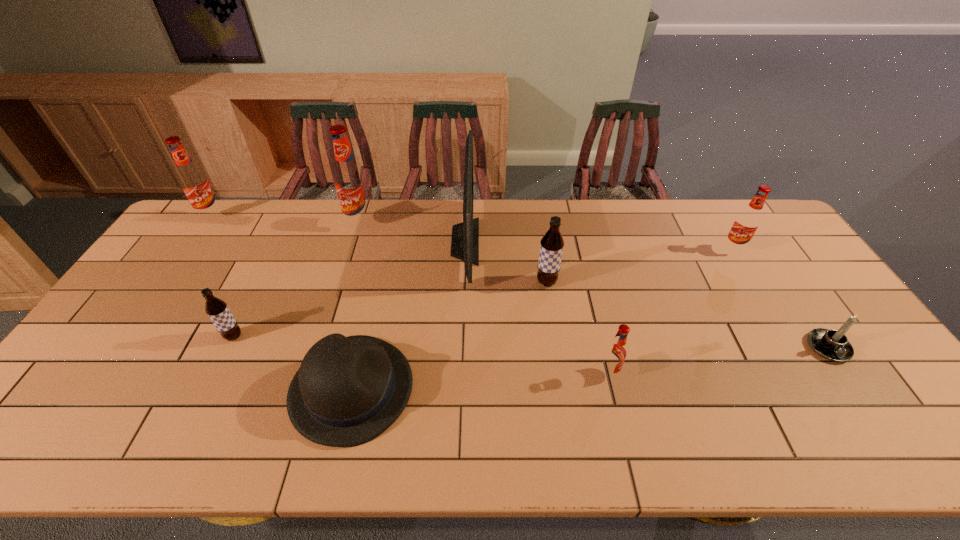
Locate an element on the screen. the biggest red root beer is located at coordinates (350, 182).

Locate an element on the screen. the third red root beer from right to left is located at coordinates (350, 182).

Identify the location of the leftmost object. This screenshot has width=960, height=540. (195, 184).

Identify the location of the leftmost red root beer. (195, 184).

Where is `monitor`? The height and width of the screenshot is (540, 960). monitor is located at coordinates (465, 236).

The height and width of the screenshot is (540, 960). Find the location of `the fifth object from left to right`. the fifth object from left to right is located at coordinates (465, 236).

Locate an element on the screen. The width and height of the screenshot is (960, 540). the right brown root beer is located at coordinates (552, 243).

Identify the location of the farther brown root beer. The height and width of the screenshot is (540, 960). (552, 243).

Where is `the rightmost root beer`? the rightmost root beer is located at coordinates (747, 222).

The image size is (960, 540). I want to click on the third farthest red root beer, so click(x=747, y=222).